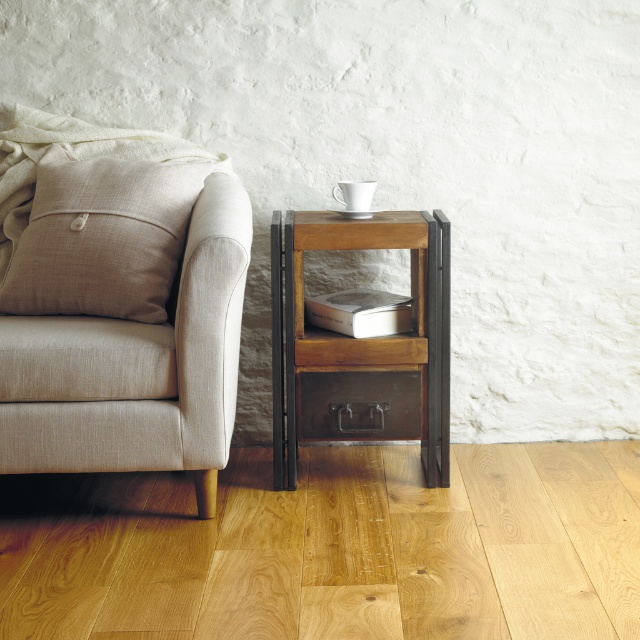
You are organizing a small party and need to place a 12 inch wide decorative plate between the beige linen pillow at left and the metallic drawer at lower center. Can the space between them accommodate the plate?

The beige linen pillow at left is wider than the metallic drawer at lower center. Since the space between them must be at least 12 inches wide to fit the plate, but the exact width isn